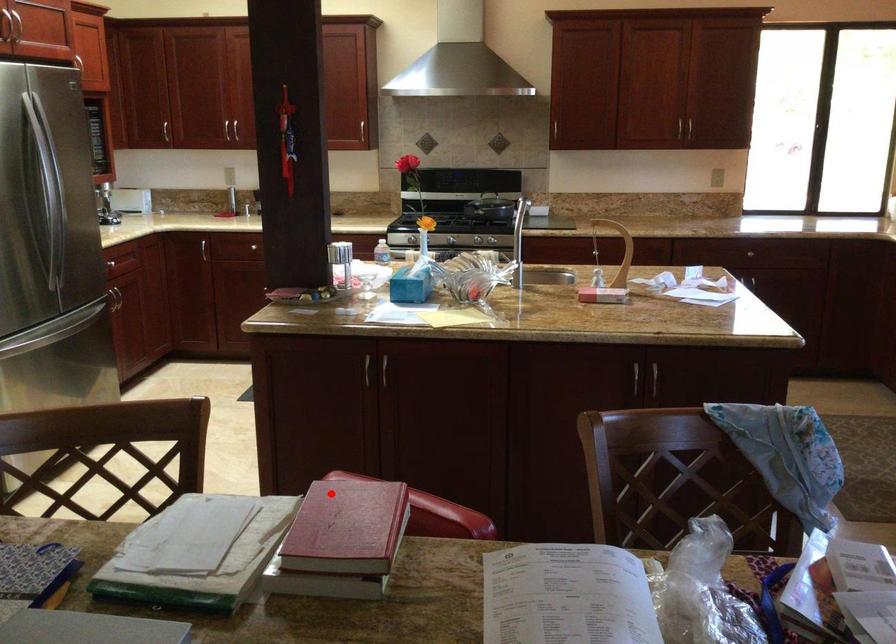
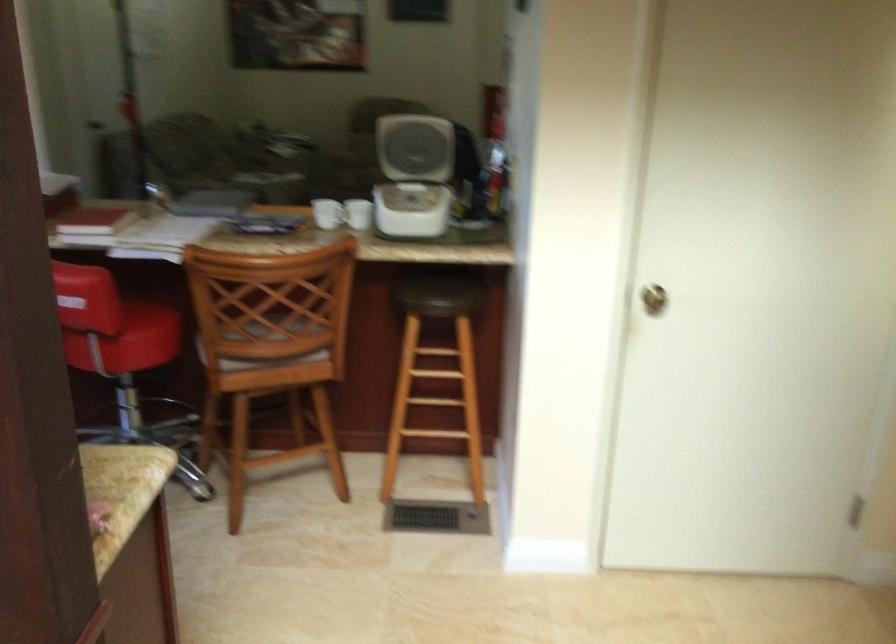
Question: I am providing you with two images of the same scene from different viewpoints. A red point is marked on the first image. At the location where the point appears in image 1, is it still visible in image 2?

Choices:
 (A) Yes
 (B) No

Answer: (A)